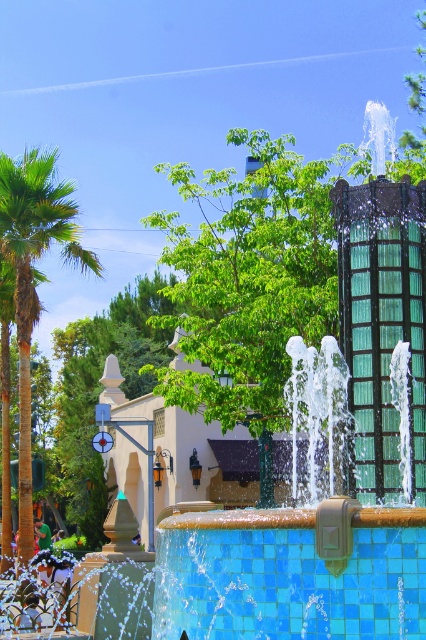
Which is more to the left, blue mosaic tile swimming pool at center or green leafy palm tree at left?

From the viewer's perspective, green leafy palm tree at left appears more on the left side.

Which is above, blue mosaic tile swimming pool at center or green leafy palm tree at left?

green leafy palm tree at left is higher up.

Locate an element on the screen. The image size is (426, 640). blue mosaic tile swimming pool at center is located at coordinates (288, 577).